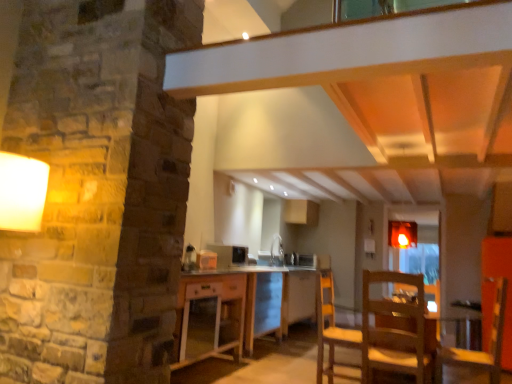
Question: Is transparent glass door at center at the right side of white glossy sink at center?

Choices:
 (A) yes
 (B) no

Answer: (A)

Question: From the image's perspective, is transparent glass door at center located beneath white glossy sink at center?

Choices:
 (A) no
 (B) yes

Answer: (B)

Question: Can you confirm if transparent glass door at center is bigger than white glossy sink at center?

Choices:
 (A) yes
 (B) no

Answer: (A)

Question: Can you confirm if transparent glass door at center is shorter than white glossy sink at center?

Choices:
 (A) yes
 (B) no

Answer: (B)

Question: Is transparent glass door at center smaller than white glossy sink at center?

Choices:
 (A) no
 (B) yes

Answer: (A)

Question: Is white glossy sink at center inside transparent glass door at center?

Choices:
 (A) no
 (B) yes

Answer: (A)

Question: Could you tell me if transparent glass door at center is turned towards wooden table at center?

Choices:
 (A) no
 (B) yes

Answer: (A)

Question: Can you confirm if transparent glass door at center is positioned to the right of wooden table at center?

Choices:
 (A) yes
 (B) no

Answer: (A)

Question: Is transparent glass door at center to the left of wooden table at center from the viewer's perspective?

Choices:
 (A) yes
 (B) no

Answer: (B)

Question: Is transparent glass door at center further to camera compared to wooden table at center?

Choices:
 (A) yes
 (B) no

Answer: (A)

Question: From the image's perspective, is transparent glass door at center on wooden table at center?

Choices:
 (A) yes
 (B) no

Answer: (A)

Question: Is transparent glass door at center positioned far away from wooden table at center?

Choices:
 (A) yes
 (B) no

Answer: (A)

Question: Considering the relative sizes of transparent glass door at center and satin black microwave at center, which appears as the 2th appliance when viewed from the back, in the image provided, is transparent glass door at center smaller than satin black microwave at center, which appears as the 2th appliance when viewed from the back,?

Choices:
 (A) yes
 (B) no

Answer: (B)